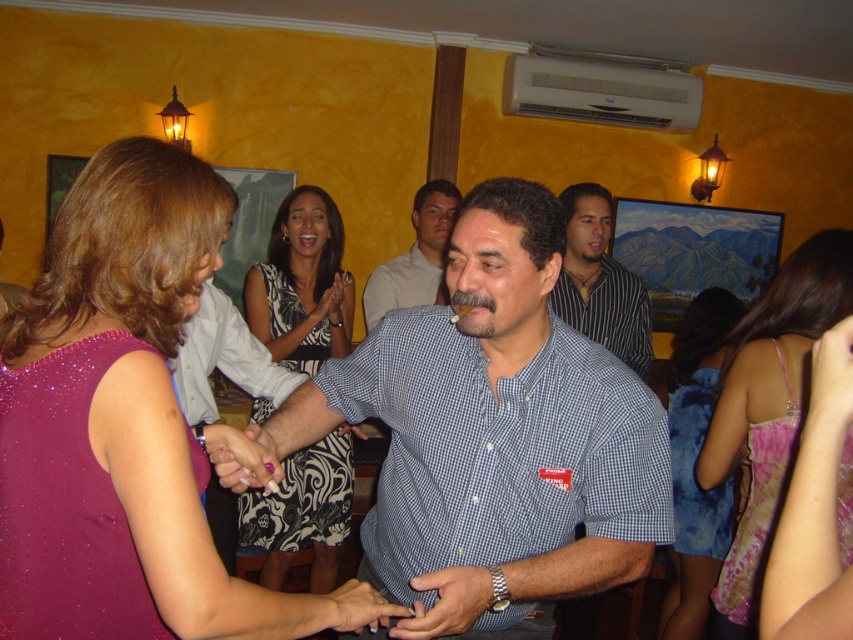
Does pink satin dress at lower right have a greater width compared to striped shirt at center?

In fact, pink satin dress at lower right might be narrower than striped shirt at center.

How far apart are pink satin dress at lower right and striped shirt at center?

pink satin dress at lower right and striped shirt at center are 32.25 inches apart from each other.

The height and width of the screenshot is (640, 853). Describe the element at coordinates (769, 410) in the screenshot. I see `pink satin dress at lower right` at that location.

Where is `pink satin dress at lower right`? The width and height of the screenshot is (853, 640). pink satin dress at lower right is located at coordinates (769, 410).

Does checkered shirt at center have a smaller size compared to pink satin ring at center?

No, checkered shirt at center is not smaller than pink satin ring at center.

Who is more distant from viewer, [440,227] or [238,484]?

Point [440,227]

Locate an element on the screen. checkered shirt at center is located at coordinates (415, 257).

Is point (776, 433) farther from viewer compared to point (366, 563)?

Yes, point (776, 433) is behind point (366, 563).

Is pink satin dress at lower right wider than smooth skin hand at center?

Correct, the width of pink satin dress at lower right exceeds that of smooth skin hand at center.

Between point (846, 301) and point (345, 632), which one is positioned in front?

Point (846, 301) is more forward.

Find the location of a particular element. This screenshot has height=640, width=853. pink satin dress at lower right is located at coordinates (769, 410).